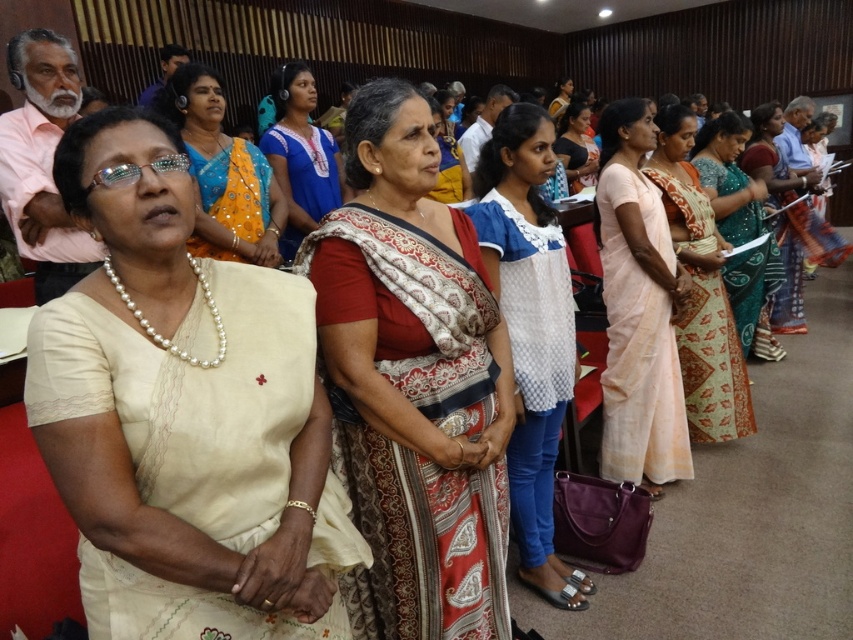
Question: Which point is closer to the camera?

Choices:
 (A) pale pink silk saree at center
 (B) white dotted blouse at center
 (C) red and white patterned saree at center

Answer: (C)

Question: Does pale pink silk saree at center have a lesser width compared to matte orange saree at upper center?

Choices:
 (A) no
 (B) yes

Answer: (B)

Question: Which point is closer to the camera?

Choices:
 (A) printed silk saree at center
 (B) pale pink silk saree at center

Answer: (B)

Question: Among these points, which one is farthest from the camera?

Choices:
 (A) (335, 196)
 (B) (440, 323)

Answer: (A)

Question: Can you confirm if printed silk saree at center is thinner than green printed saree at center?

Choices:
 (A) yes
 (B) no

Answer: (A)

Question: Is pale pink silk saree at center further to the viewer compared to matte white blouse at center?

Choices:
 (A) no
 (B) yes

Answer: (A)